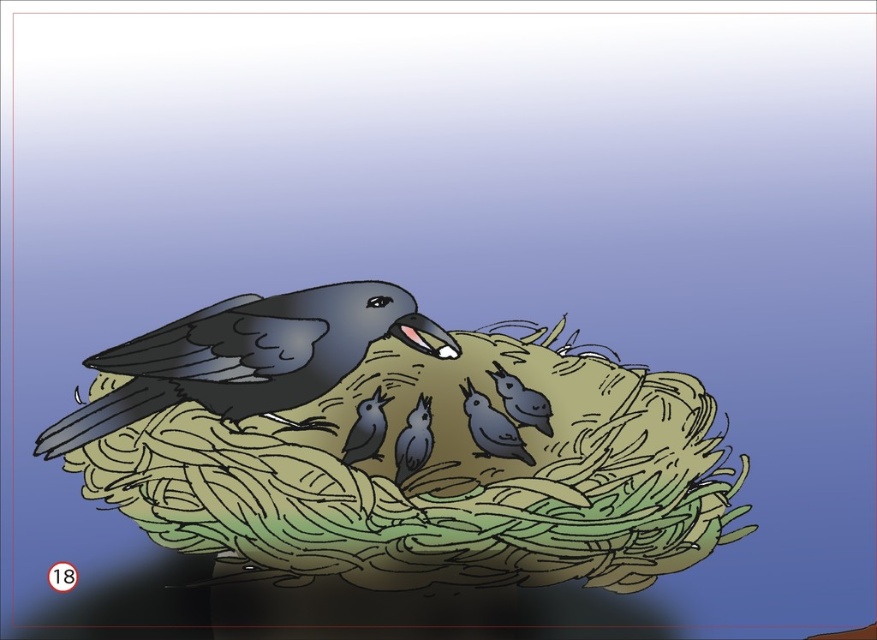
Between shiny black bird at upper center and matte gray bird at center, which one appears on the right side from the viewer's perspective?

From the viewer's perspective, matte gray bird at center appears more on the right side.

Does point (290, 321) lie behind point (398, 476)?

Yes, it is.

Where is `shiny black bird at upper center`? This screenshot has width=877, height=640. shiny black bird at upper center is located at coordinates [247, 356].

Does green woven nest at center have a larger size compared to matte gray bird at center?

Indeed, green woven nest at center has a larger size compared to matte gray bird at center.

Which is more to the left, green woven nest at center or matte gray bird at center?

green woven nest at center

Is point (294, 440) in front of point (424, 452)?

That is False.

Identify the location of green woven nest at center. The image size is (877, 640). (439, 476).

Who is taller, shiny black bird at upper center or matte gray birds at center?

Standing taller between the two is shiny black bird at upper center.

Image resolution: width=877 pixels, height=640 pixels. Identify the location of shiny black bird at upper center. (247, 356).

At what (x,y) coordinates should I click in order to perform the action: click on shiny black bird at upper center. Please return your answer as a coordinate pair (x, y). The height and width of the screenshot is (640, 877). Looking at the image, I should click on (247, 356).